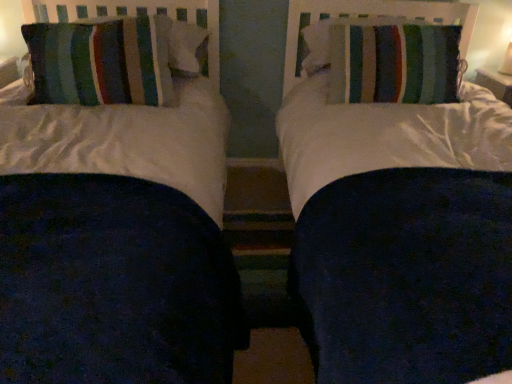
Question: Considering their positions, is striped fabric pillow at upper right, which is the 2th pillow in left-to-right order, located in front of or behind striped fabric pillow at left, the 1th pillow viewed from the left?

Choices:
 (A) behind
 (B) front

Answer: (A)

Question: Considering the positions of point (417, 94) and point (45, 24), is point (417, 94) closer or farther from the camera than point (45, 24)?

Choices:
 (A) farther
 (B) closer

Answer: (A)

Question: Considering the positions of striped fabric pillow at upper right, which is the 2th pillow in left-to-right order, and striped fabric pillow at left, the 1th pillow viewed from the left, in the image, is striped fabric pillow at upper right, which is the 2th pillow in left-to-right order, wider or thinner than striped fabric pillow at left, the 1th pillow viewed from the left,?

Choices:
 (A) thin
 (B) wide

Answer: (B)

Question: Looking at the image, does striped fabric pillow at left, the 1th pillow viewed from the left, seem bigger or smaller compared to striped fabric pillow at upper right, placed as the 1th pillow when sorted from right to left?

Choices:
 (A) big
 (B) small

Answer: (A)

Question: Looking at their shapes, would you say striped fabric pillow at left, the 1th pillow viewed from the left, is wider or thinner than striped fabric pillow at upper right, which is the 2th pillow in left-to-right order?

Choices:
 (A) thin
 (B) wide

Answer: (A)

Question: Based on their positions, is striped fabric pillow at left, arranged as the second pillow when viewed from the right, located to the left or right of striped fabric pillow at upper right, which is the 2th pillow in left-to-right order?

Choices:
 (A) left
 (B) right

Answer: (A)

Question: Is striped fabric pillow at left, arranged as the second pillow when viewed from the right, taller or shorter than striped fabric pillow at upper right, placed as the 1th pillow when sorted from right to left?

Choices:
 (A) short
 (B) tall

Answer: (B)